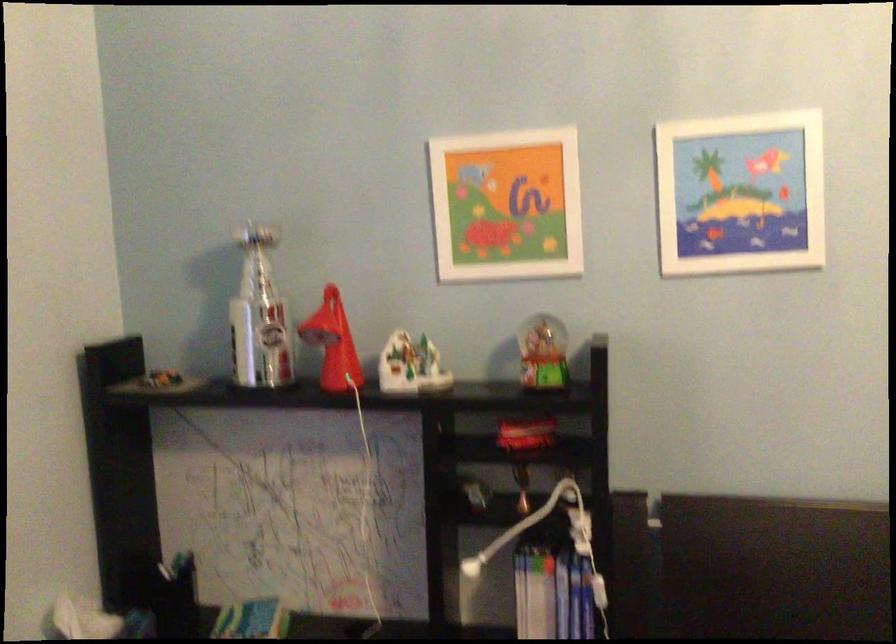
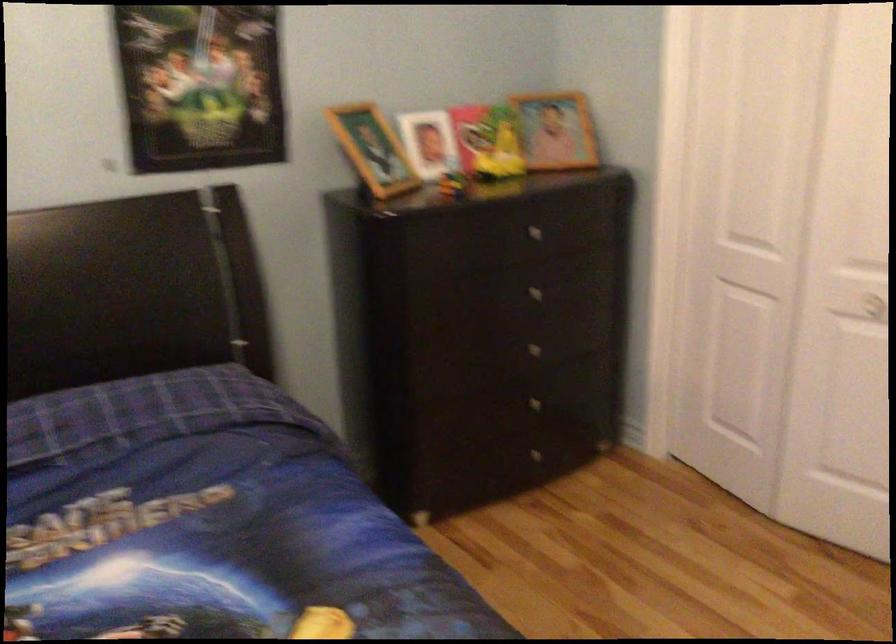
Question: The first image is from the beginning of the video and the second image is from the end. How did the camera likely rotate when shooting the video?

Choices:
 (A) Left
 (B) Right
 (C) Up
 (D) Down

Answer: (B)